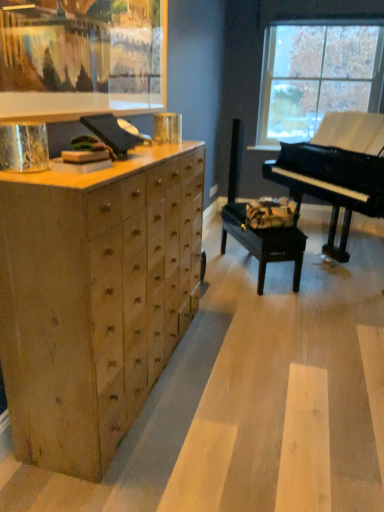
Identify the location of vacant area to the right of natural wood chest of drawers at left. (259, 379).